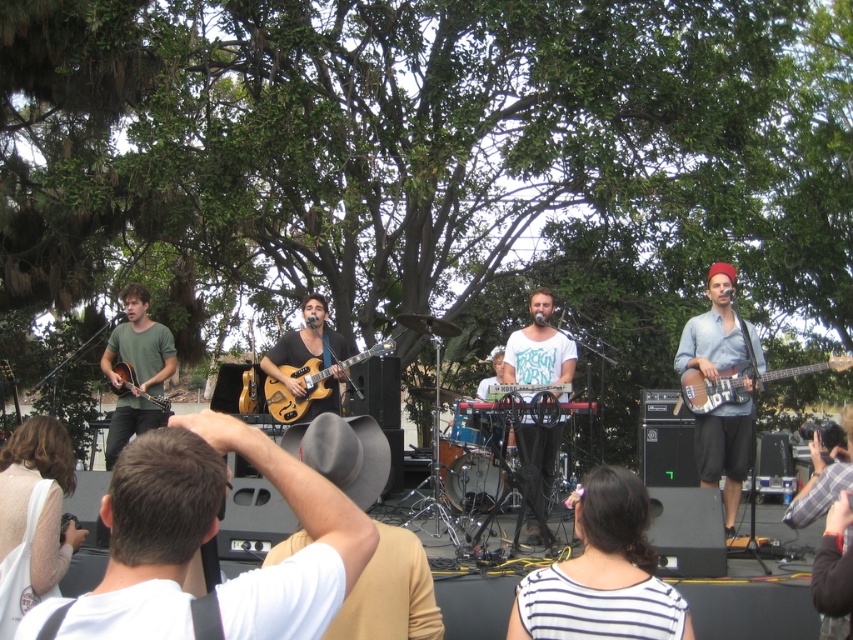
This screenshot has height=640, width=853. Identify the location of white striped shirt at center. (602, 573).

Is white striped shirt at center above matte brown electric guitar at center?

No, white striped shirt at center is not above matte brown electric guitar at center.

The width and height of the screenshot is (853, 640). What are the coordinates of `white striped shirt at center` in the screenshot? It's located at (602, 573).

Can you confirm if white lace shirt at lower left is shorter than wooden electric bass at right?

Incorrect, white lace shirt at lower left's height does not fall short of wooden electric bass at right's.

Between point (20, 552) and point (717, 401), which one is positioned in front?

Point (20, 552) is more forward.

Which is in front, point (56, 497) or point (708, 392)?

Point (56, 497) is more forward.

Find the location of a particular element. white lace shirt at lower left is located at coordinates (33, 516).

Is white matte hat at center below matte brown acoustic guitar at left?

Result: Yes, white matte hat at center is below matte brown acoustic guitar at left.

Who is more distant from viewer, (193,480) or (122,392)?

The point (122,392) is behind.

You are a GUI agent. You are given a task and a screenshot of the screen. Output one action in this format:
    pyautogui.click(x=<x>, y=<y>)
    Task: Click on the white matte hat at center
    Image resolution: width=853 pixels, height=640 pixels.
    Given the screenshot: What is the action you would take?
    pyautogui.click(x=212, y=536)

Where is `white matte hat at center`? white matte hat at center is located at coordinates 212,536.